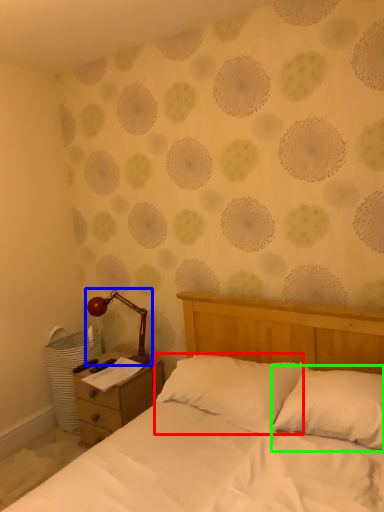
Question: Which object is the closest to the pillow (highlighted by a red box)? Choose among these: lamp (highlighted by a blue box) or pillow (highlighted by a green box).

Choices:
 (A) lamp
 (B) pillow

Answer: (B)